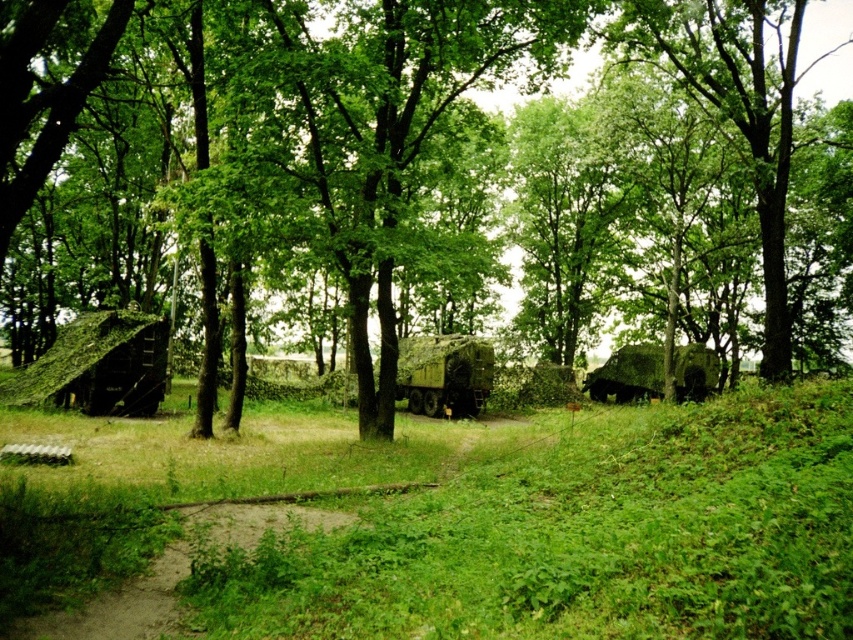
Question: Can you confirm if green grassy at lower center is smaller than green leafy tree at center?

Choices:
 (A) yes
 (B) no

Answer: (A)

Question: Which of the following is the closest to the observer?

Choices:
 (A) green moss-covered log cabin at left
 (B) camouflage fabric tent at center

Answer: (A)

Question: Is green grassy at lower center bigger than green moss-covered log cabin at left?

Choices:
 (A) no
 (B) yes

Answer: (B)

Question: Which object appears closest to the camera in this image?

Choices:
 (A) camouflage fabric tent at center
 (B) green leafy tree at center
 (C) green grassy at lower center

Answer: (C)

Question: Does green leafy tree at center have a lesser width compared to camouflage fabric tent at center?

Choices:
 (A) no
 (B) yes

Answer: (A)

Question: Which point is closer to the camera?

Choices:
 (A) green leafy tree at center
 (B) green grassy at lower center

Answer: (B)